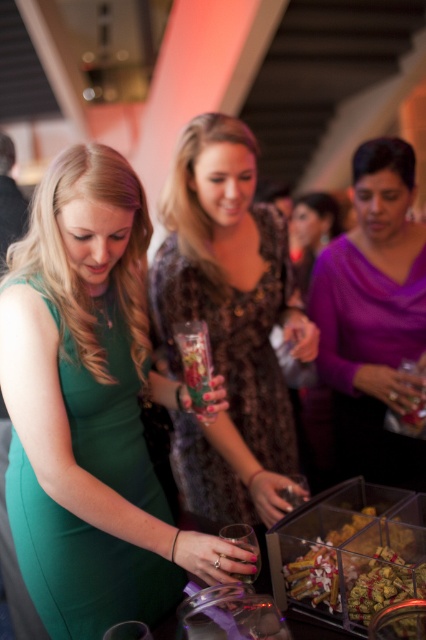
Question: Can you confirm if purple matte sweater at center is positioned above translucent glass vase at center?

Choices:
 (A) yes
 (B) no

Answer: (A)

Question: Which point appears closest to the camera in this image?

Choices:
 (A) tap(359, 438)
 (B) tap(120, 330)
 (C) tap(275, 284)

Answer: (B)

Question: Is green satin dress at lower left bigger than translucent glass vase at center?

Choices:
 (A) yes
 (B) no

Answer: (A)

Question: Is printed velvet dress at center bigger than translucent glass vase at center?

Choices:
 (A) yes
 (B) no

Answer: (A)

Question: Among these points, which one is farthest from the camera?

Choices:
 (A) (394, 252)
 (B) (189, 436)
 (C) (112, 307)

Answer: (A)

Question: Which of these objects is positioned farthest from the translucent glass vase at center?

Choices:
 (A) translucent plastic tray at lower right
 (B) printed velvet dress at center

Answer: (A)